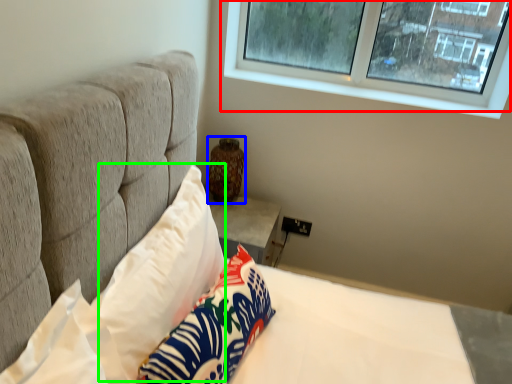
Question: Which is nearer to the window (highlighted by a red box)? vase (highlighted by a blue box) or pillow (highlighted by a green box).

Choices:
 (A) vase
 (B) pillow

Answer: (A)